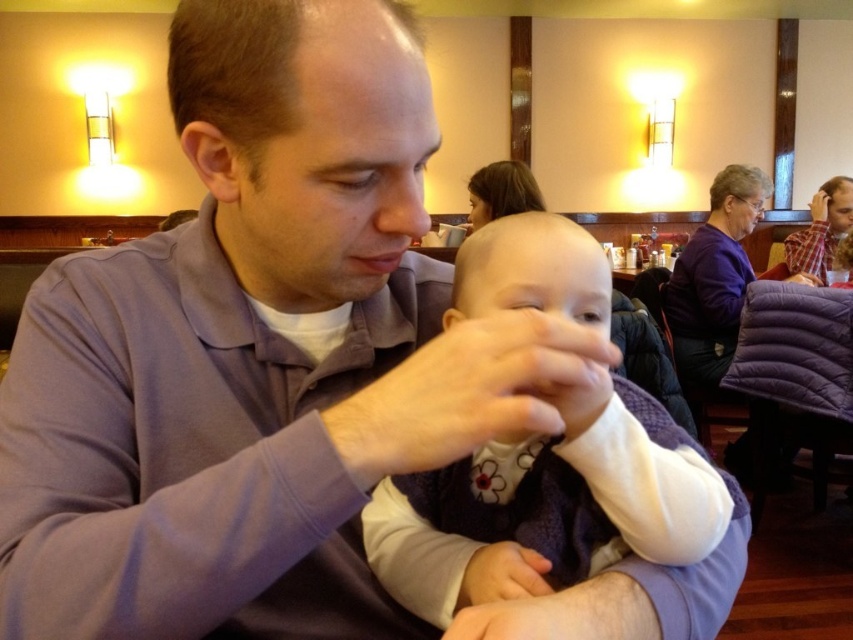
Can you confirm if white soft fabric baby at center is bigger than plaid shirt at right?

Actually, white soft fabric baby at center might be smaller than plaid shirt at right.

The image size is (853, 640). What do you see at coordinates (550, 500) in the screenshot? I see `white soft fabric baby at center` at bounding box center [550, 500].

Is point (722, 497) positioned behind point (822, 209)?

No, it is not.

Identify the location of white soft fabric baby at center. (550, 500).